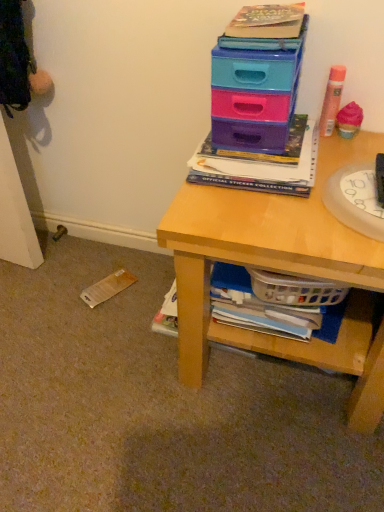
You are a GUI agent. You are given a task and a screenshot of the screen. Output one action in this format:
    pyautogui.click(x=<x>, y=<y>)
    Task: Click on the free spot in front of pink matte hair spray at upper right
    
    Given the screenshot: What is the action you would take?
    pyautogui.click(x=326, y=157)